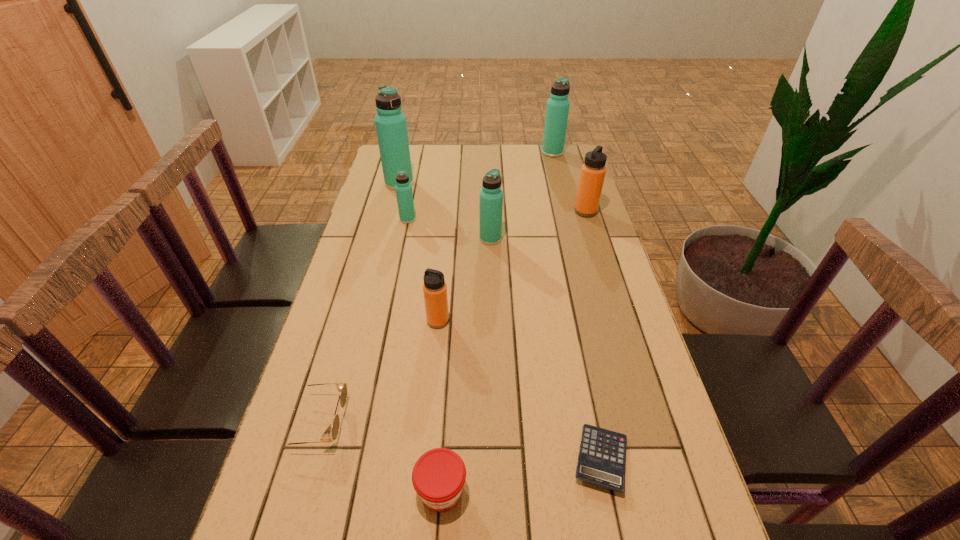
Find the location of `vacant space that's between the shortest object and the second nearest aqua thermos bottle`. vacant space that's between the shortest object and the second nearest aqua thermos bottle is located at coordinates (504, 339).

Where is `free spot between the biggest aqua thermos bottle and the jam`? free spot between the biggest aqua thermos bottle and the jam is located at coordinates (420, 337).

Find the location of `vacant space that is in between the second nearest thermos bottle and the third smallest aqua thermos bottle`. vacant space that is in between the second nearest thermos bottle and the third smallest aqua thermos bottle is located at coordinates (521, 195).

In order to click on free spot between the bigger orange thermos bottle and the third aqua thermos bottle from left to right in this screenshot , I will do `click(538, 225)`.

This screenshot has width=960, height=540. Identify the location of empty location between the sixth object from left to right and the fourth thermos bottle from right to left. click(x=465, y=280).

Identify the location of vacant area that lies between the shortest object and the right orange thermos bottle. (593, 335).

Where is `vacant point located between the fifth nearest object and the tallest object`? Image resolution: width=960 pixels, height=540 pixels. vacant point located between the fifth nearest object and the tallest object is located at coordinates pos(444,211).

At what (x,y) coordinates should I click in order to perform the action: click on vacant space in between the fifth nearest thermos bottle and the sunglasses. Please return your answer as a coordinate pair (x, y). This screenshot has height=540, width=960. Looking at the image, I should click on (358, 302).

You are a GUI agent. You are given a task and a screenshot of the screen. Output one action in this format:
    pyautogui.click(x=<x>, y=<y>)
    Task: Click on the vacant space that's between the fifth nearest thermos bottle and the jam
    The image size is (960, 540).
    Given the screenshot: What is the action you would take?
    pyautogui.click(x=420, y=337)

Identify the location of object that can be found as the third closest to the second farthest thermos bottle. The image size is (960, 540). (557, 109).